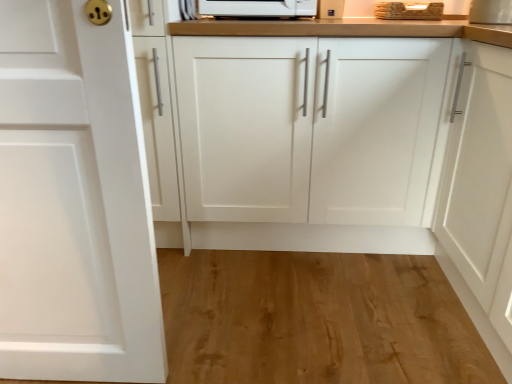
You are a GUI agent. You are given a task and a screenshot of the screen. Output one action in this format:
    pyautogui.click(x=<x>, y=<y>)
    Task: Click on the free space above natural wood flooring at lower center (from a real-world perspective)
    This screenshot has width=512, height=384.
    Given the screenshot: What is the action you would take?
    pyautogui.click(x=316, y=312)